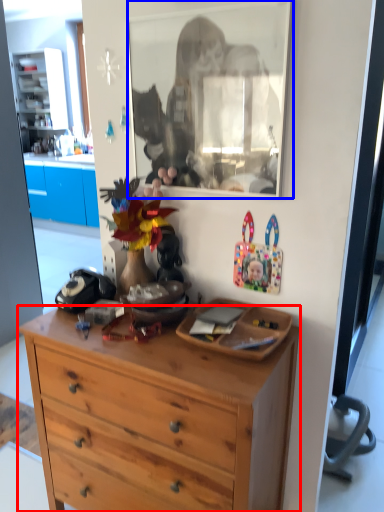
Question: Which of the following is the closest to the observer, desk (highlighted by a red box) or mirror (highlighted by a blue box)?

Choices:
 (A) desk
 (B) mirror

Answer: (A)